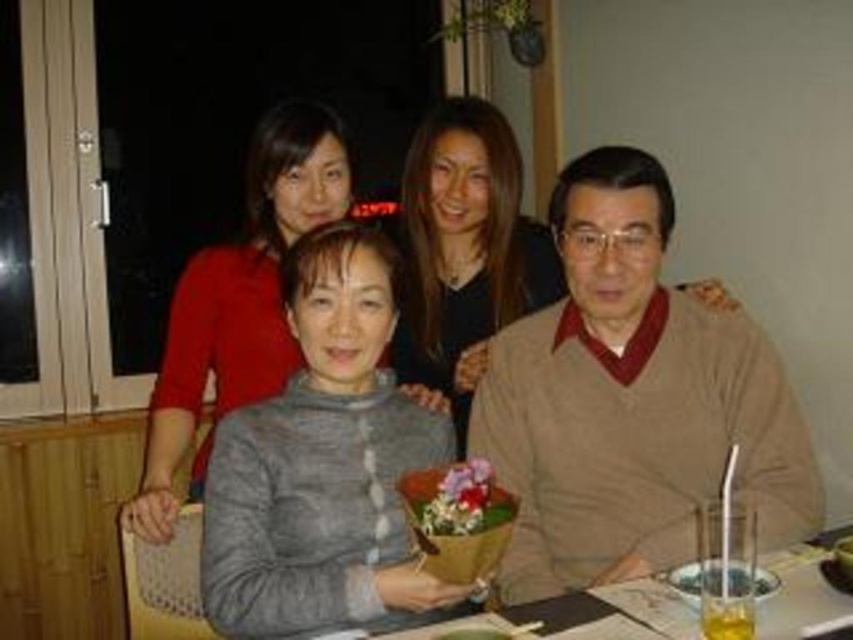
Question: Can you confirm if gray wool sweater at center is positioned above translucent glass bowl at lower right?

Choices:
 (A) yes
 (B) no

Answer: (A)

Question: Which of the following is the farthest from the observer?

Choices:
 (A) matte gray sweater at center
 (B) gray wool sweater at center
 (C) smooth wooden table at center

Answer: (A)

Question: Does gray wool sweater at center have a larger size compared to smooth wooden table at center?

Choices:
 (A) yes
 (B) no

Answer: (A)

Question: Which object appears farthest from the camera in this image?

Choices:
 (A) translucent glass bowl at lower right
 (B) gray wool sweater at center
 (C) smooth wooden table at center
 (D) matte gray sweater at center

Answer: (D)

Question: Which object is the farthest from the smooth wooden table at center?

Choices:
 (A) gray wool sweater at center
 (B) matte gray sweater at center
 (C) gray knitted sweater at center
 (D) translucent glass bowl at lower right

Answer: (C)

Question: Is matte gray sweater at center bigger than smooth wooden table at center?

Choices:
 (A) no
 (B) yes

Answer: (B)